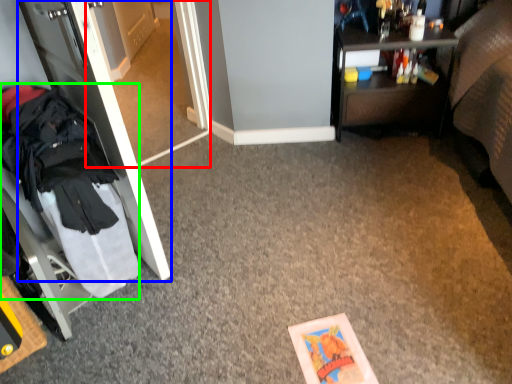
Question: Which is nearer to the glass door (highlighted by a red box)? door (highlighted by a blue box) or clothing (highlighted by a green box).

Choices:
 (A) door
 (B) clothing

Answer: (A)